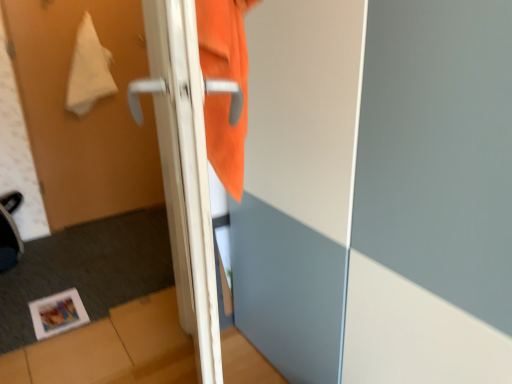
Question: Which direction should I rotate to look at orange fabric at center, the third screen door viewed from the left?

Choices:
 (A) left
 (B) right

Answer: (B)

Question: Does white matte towel at upper left, which is the 1th screen door from left to right, have a larger size compared to white glossy door handle at center?

Choices:
 (A) no
 (B) yes

Answer: (A)

Question: Is white matte towel at upper left, placed as the 3th screen door when sorted from right to left, thinner than white glossy door handle at center?

Choices:
 (A) no
 (B) yes

Answer: (B)

Question: Considering the relative sizes of white matte towel at upper left, placed as the 3th screen door when sorted from right to left, and white glossy door handle at center in the image provided, is white matte towel at upper left, placed as the 3th screen door when sorted from right to left, taller than white glossy door handle at center?

Choices:
 (A) no
 (B) yes

Answer: (B)

Question: Is white matte towel at upper left, placed as the 3th screen door when sorted from right to left, looking in the opposite direction of white glossy door handle at center?

Choices:
 (A) yes
 (B) no

Answer: (B)

Question: Is white matte towel at upper left, placed as the 3th screen door when sorted from right to left, to the right of white glossy door handle at center from the viewer's perspective?

Choices:
 (A) yes
 (B) no

Answer: (B)

Question: Is white matte towel at upper left, placed as the 3th screen door when sorted from right to left, shorter than white glossy door handle at center?

Choices:
 (A) no
 (B) yes

Answer: (A)

Question: Is white glossy door handle at center oriented towards white matte towel at upper left, placed as the 3th screen door when sorted from right to left?

Choices:
 (A) yes
 (B) no

Answer: (B)

Question: Can you confirm if white glossy door handle at center is taller than white matte towel at upper left, placed as the 3th screen door when sorted from right to left?

Choices:
 (A) no
 (B) yes

Answer: (A)

Question: Is white glossy door handle at center smaller than white matte towel at upper left, placed as the 3th screen door when sorted from right to left?

Choices:
 (A) yes
 (B) no

Answer: (B)

Question: Is white glossy door handle at center wider than white matte towel at upper left, placed as the 3th screen door when sorted from right to left?

Choices:
 (A) no
 (B) yes

Answer: (B)

Question: Considering the relative positions of white glossy door handle at center and white matte towel at upper left, which is the 1th screen door from left to right, in the image provided, is white glossy door handle at center behind white matte towel at upper left, which is the 1th screen door from left to right,?

Choices:
 (A) no
 (B) yes

Answer: (A)

Question: Is white glossy door handle at center not inside white matte towel at upper left, which is the 1th screen door from left to right?

Choices:
 (A) yes
 (B) no

Answer: (A)

Question: Does matte paper photo frame at lower left have a lesser width compared to white glossy door handle at left, the second screen door when ordered from left to right?

Choices:
 (A) no
 (B) yes

Answer: (A)